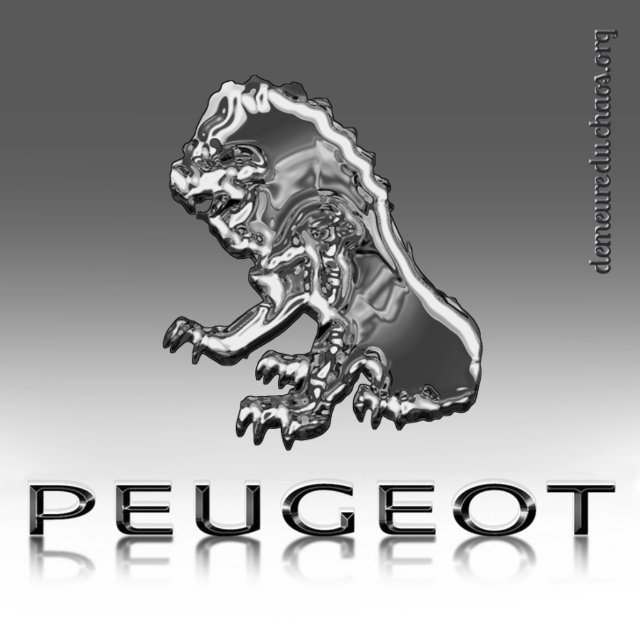
Question: Considering the relative positions of shiny metallic lion at center and chrome metallic logo at center in the image provided, where is shiny metallic lion at center located with respect to chrome metallic logo at center?

Choices:
 (A) left
 (B) right

Answer: (A)

Question: Is shiny metallic lion at center thinner than chrome metallic logo at center?

Choices:
 (A) yes
 (B) no

Answer: (A)

Question: From the image, what is the correct spatial relationship of shiny metallic lion at center in relation to chrome metallic logo at center?

Choices:
 (A) below
 (B) above

Answer: (B)

Question: Which of the following is the farthest from the observer?

Choices:
 (A) (452, 401)
 (B) (83, 493)

Answer: (A)

Question: Which of the following is the closest to the observer?

Choices:
 (A) (403, 273)
 (B) (64, 488)

Answer: (B)